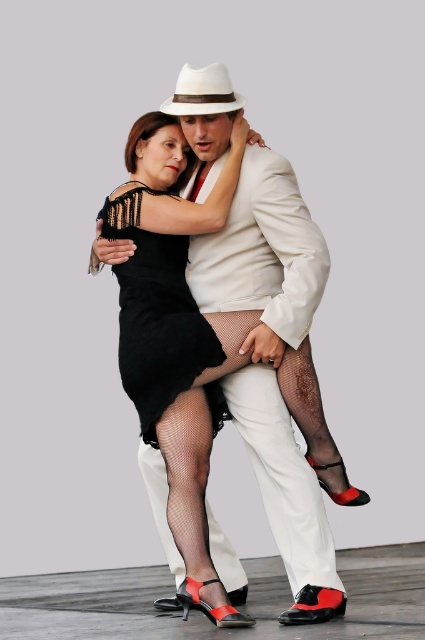
Question: Which object appears closest to the camera in this image?

Choices:
 (A) matte black dress at center
 (B) black mesh dress at center
 (C) fishnet stockings at center

Answer: (A)

Question: Can you confirm if matte black dress at center is positioned above fishnet stockings at center?

Choices:
 (A) yes
 (B) no

Answer: (A)

Question: Does matte black dress at center appear on the left side of white felt fedora at center?

Choices:
 (A) yes
 (B) no

Answer: (B)

Question: Which object appears closest to the camera in this image?

Choices:
 (A) black mesh dress at center
 (B) fishnet stockings at center

Answer: (B)

Question: Can you confirm if fishnet stockings at center is positioned below white felt fedora at center?

Choices:
 (A) no
 (B) yes

Answer: (B)

Question: Among these points, which one is nearest to the camera?

Choices:
 (A) (210, 541)
 (B) (124, 372)
 (C) (227, 72)

Answer: (B)